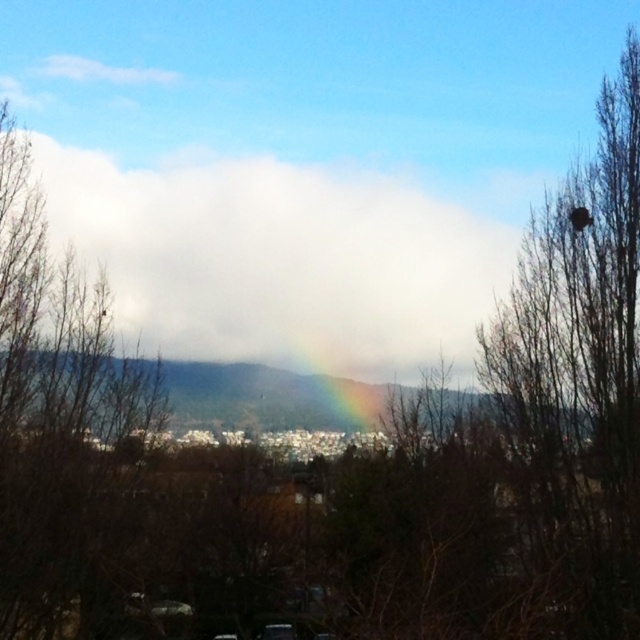
Question: Which of the following is the closest to the observer?

Choices:
 (A) white fluffy cloud at center
 (B) brown textured bird nest at upper right
 (C) rainbow at center
 (D) brown leafless tree at left

Answer: (B)

Question: Is white fluffy cloud at center in front of brown textured bird nest at upper right?

Choices:
 (A) yes
 (B) no

Answer: (B)

Question: Can you confirm if white fluffy cloud at center is wider than rainbow at center?

Choices:
 (A) yes
 (B) no

Answer: (A)

Question: Observing the image, what is the correct spatial positioning of brown leafless tree at left in reference to rainbow at center?

Choices:
 (A) above
 (B) below

Answer: (A)

Question: Which point is farther to the camera?

Choices:
 (A) (125, 541)
 (B) (225, 260)

Answer: (B)

Question: Which object is positioned closest to the rainbow at center?

Choices:
 (A) white fluffy cloud at center
 (B) brown leafless tree at left
 (C) brown textured bird nest at upper right

Answer: (A)